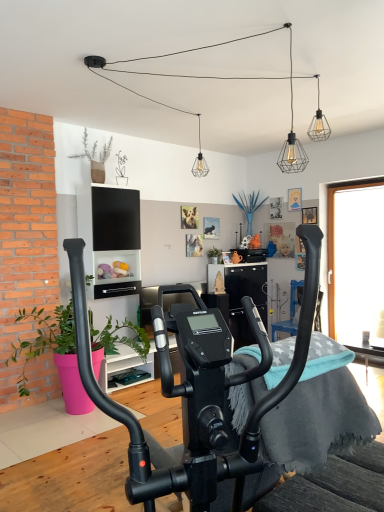
Question: Is point (364, 355) closer or farther from the camera than point (302, 360)?

Choices:
 (A) farther
 (B) closer

Answer: (A)

Question: From the image's perspective, relative to black matte stationary bicycle at center, is wooden table at lower right above or below?

Choices:
 (A) above
 (B) below

Answer: (B)

Question: Estimate the real-world distances between objects in this image. Which object is closer to the wooden table at lower right?

Choices:
 (A) black matte stationary bicycle at center
 (B) green matte plant at left, the 1th plant from the front
 (C) blue fabric armchair at center
 (D) green matte plant at center, which is the second plant in front-to-back order
 (E) metal wire cage at upper center

Answer: (C)

Question: Based on their relative distances, which object is farther from the blue fabric armchair at center?

Choices:
 (A) metal wire cage at upper center
 (B) gray fleece blanket at center
 (C) wooden table at lower right
 (D) green matte plant at center, arranged as the first plant when viewed from the back
 (E) black matte stationary bicycle at center

Answer: (A)